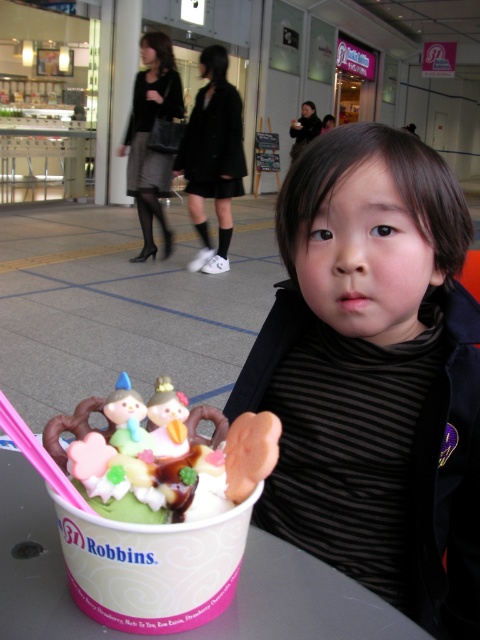
Based on the photo, you are a fashion designer observing a child wearing a black striped shirt at center and a matte black skirt at center. Which piece of clothing is larger in size?

The matte black skirt at center is larger in size compared to the black striped shirt at center.

You are a photographer taking a picture of the scene. You need to focus on the black striped shirt at center and the black fabric skirt at center. Which one should you adjust your camera to focus on first if you want to capture both in sharp detail?

The black striped shirt at center is to the right of black fabric skirt at center, so you should focus on the black fabric skirt at center first because it is closer to the camera. This way, both objects will be in focus as the rightmost object might be slightly further away depending on the depth of field.